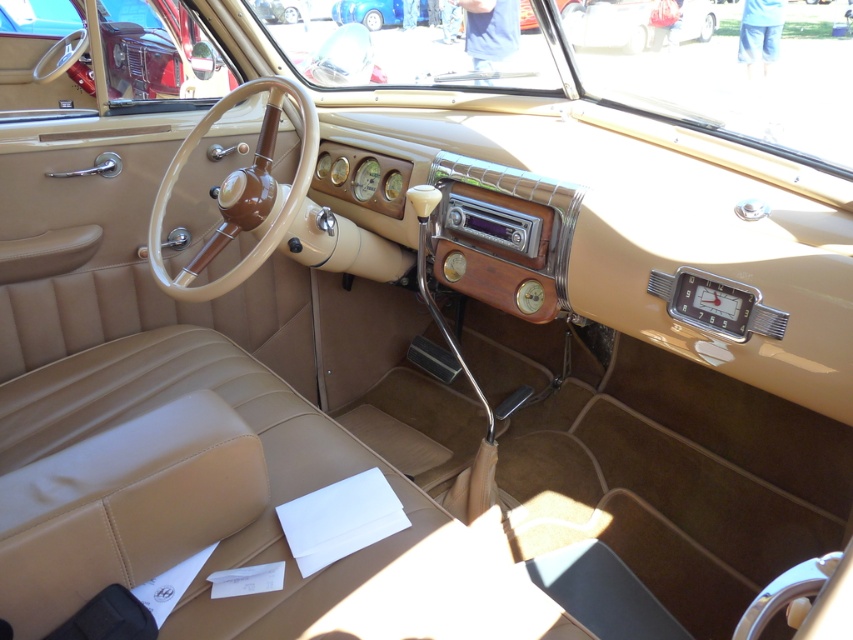
Which is below, matte wood steering wheel at upper left or blue metallic car at upper center?

matte wood steering wheel at upper left

Does matte wood steering wheel at upper left appear over blue metallic car at upper center?

No.

Where is `matte wood steering wheel at upper left`? matte wood steering wheel at upper left is located at coordinates (103, 52).